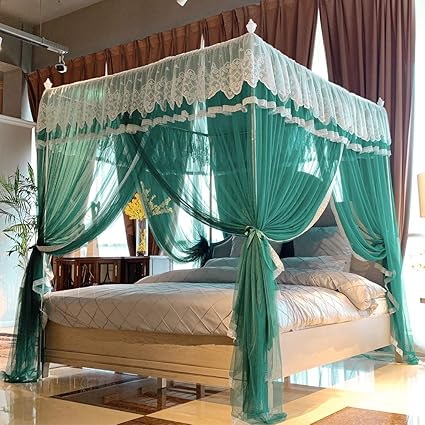
What are the coordinates of `light` in the screenshot? It's located at (363, 385).